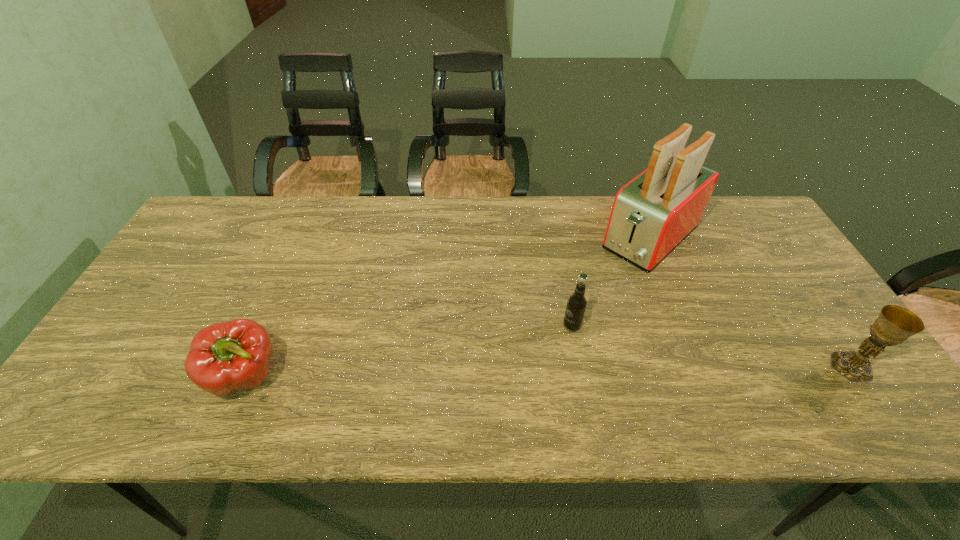
In the image, there is a desktop. Where is `vacant space at the near edge`? Image resolution: width=960 pixels, height=540 pixels. vacant space at the near edge is located at coordinates (681, 364).

Where is `free space at the left edge of the desktop`? This screenshot has height=540, width=960. free space at the left edge of the desktop is located at coordinates (225, 247).

Where is `free region at the right edge of the desktop`? The image size is (960, 540). free region at the right edge of the desktop is located at coordinates (761, 280).

I want to click on blank space at the far right corner of the desktop, so point(743,215).

The width and height of the screenshot is (960, 540). In order to click on free space between the tallest object and the chalice in this screenshot , I will do `click(751, 302)`.

Find the location of `blank region between the third object from left to right and the pepper`. blank region between the third object from left to right and the pepper is located at coordinates (448, 308).

Where is `free area in between the chalice and the farthest object`? free area in between the chalice and the farthest object is located at coordinates (751, 302).

Find the location of a particular element. Image resolution: width=960 pixels, height=540 pixels. vacant area that lies between the leftmost object and the second farthest object is located at coordinates (409, 352).

Find the location of a particular element. The image size is (960, 540). free space between the pepper and the chalice is located at coordinates (549, 372).

Where is `free space between the farthest object and the root beer`? free space between the farthest object and the root beer is located at coordinates (612, 281).